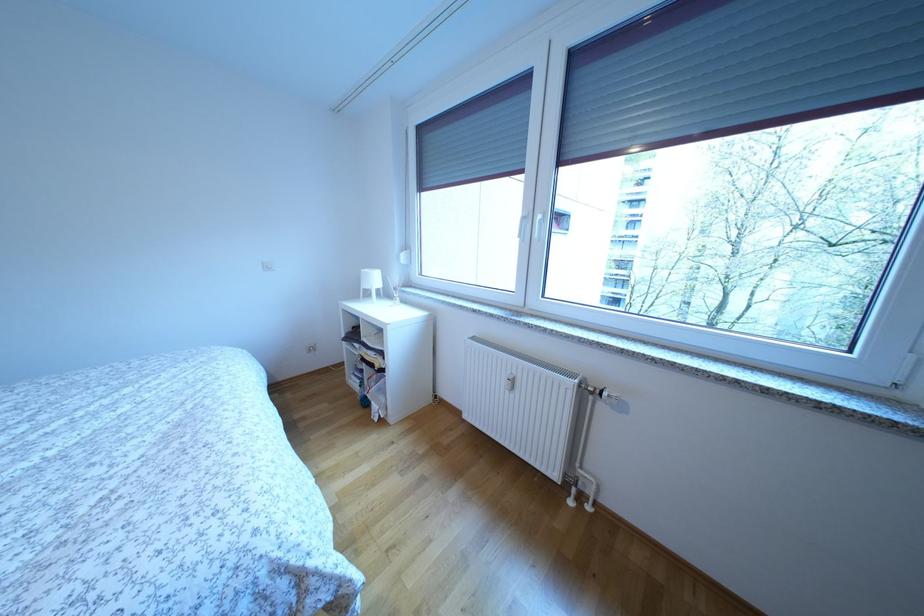
You are a GUI agent. You are given a task and a screenshot of the screen. Output one action in this format:
    pyautogui.click(x=<x>, y=<y>)
    Task: Click on the white window handle
    
    Given the screenshot: What is the action you would take?
    pyautogui.click(x=538, y=227)